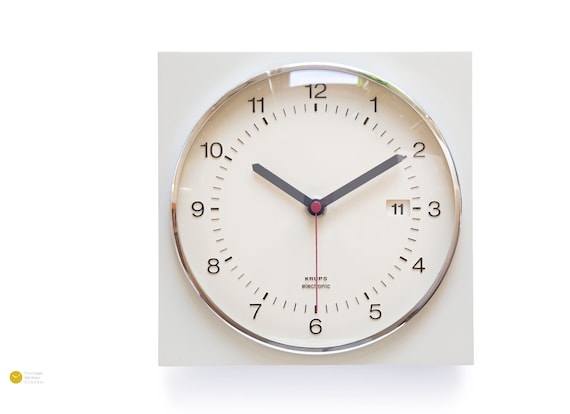
Find the location of `clock`. clock is located at coordinates (361, 240).